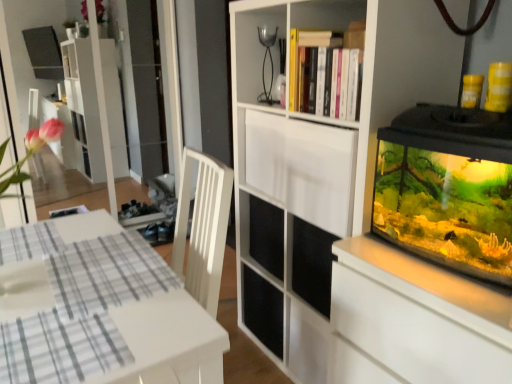
What are the coordinates of `free point above white glossy table at lower left (from a real-world perspective)` in the screenshot? It's located at (71, 276).